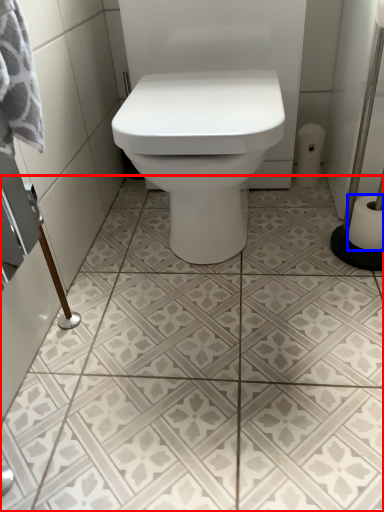
Question: Which object is further to the camera taking this photo, ceramic tile (highlighted by a red box) or toilet paper (highlighted by a blue box)?

Choices:
 (A) ceramic tile
 (B) toilet paper

Answer: (B)